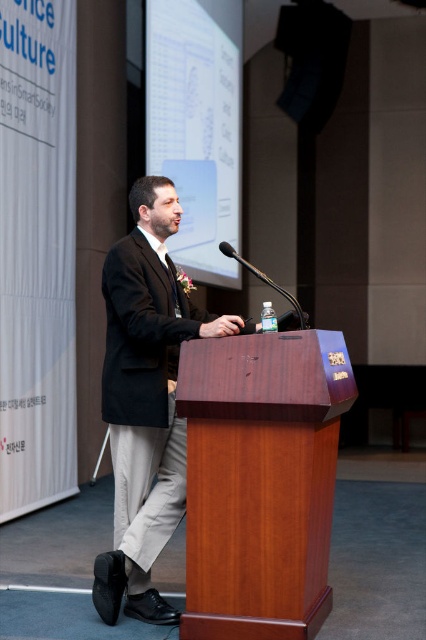
Question: Can you confirm if wooden podium at center is thinner than metallic silver microphone at center?

Choices:
 (A) yes
 (B) no

Answer: (B)

Question: Which object is the closest to the matte black suit at center?

Choices:
 (A) wooden podium at center
 (B) metallic silver microphone at center

Answer: (A)

Question: Is wooden podium at center wider than metallic silver microphone at center?

Choices:
 (A) yes
 (B) no

Answer: (A)

Question: Does matte black suit at center have a greater width compared to metallic silver microphone at center?

Choices:
 (A) yes
 (B) no

Answer: (A)

Question: Estimate the real-world distances between objects in this image. Which object is farther from the matte black suit at center?

Choices:
 (A) metallic silver microphone at center
 (B) wooden podium at center

Answer: (A)

Question: Among these points, which one is farthest from the camera?

Choices:
 (A) (215, 328)
 (B) (322, 472)

Answer: (B)